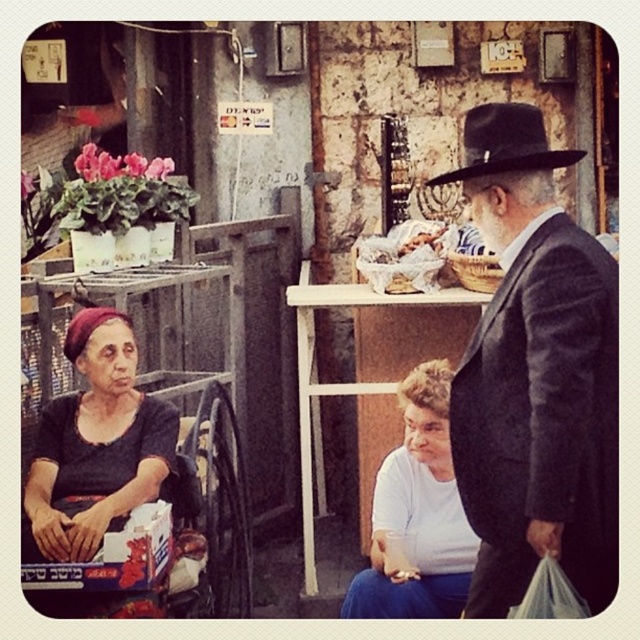
Question: Does matte black suit at right have a smaller size compared to black felt fedora at center?

Choices:
 (A) yes
 (B) no

Answer: (B)

Question: Which point is closer to the camera taking this photo?

Choices:
 (A) (493, 145)
 (B) (100, 509)
 (C) (424, 518)

Answer: (A)

Question: Which point is closer to the camera taking this photo?

Choices:
 (A) (400, 481)
 (B) (614, 305)

Answer: (B)

Question: Is dark gray fabric headscarf at lower left in front of black felt fedora at center?

Choices:
 (A) yes
 (B) no

Answer: (B)

Question: Can you confirm if matte black suit at right is thinner than dark gray fabric headscarf at lower left?

Choices:
 (A) no
 (B) yes

Answer: (B)

Question: Among these points, which one is nearest to the camera?

Choices:
 (A) (436, 548)
 (B) (156, 413)
 (C) (474, 132)
 (D) (586, 349)

Answer: (D)